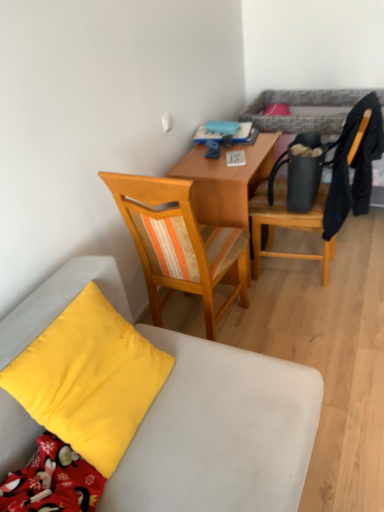
Question: From a real-world perspective, is yellow matte pillow at lower left under matte black chair at upper right, the first chair in the right-to-left sequence?

Choices:
 (A) yes
 (B) no

Answer: (B)

Question: Does yellow matte pillow at lower left have a greater width compared to matte black chair at upper right, which appears as the 3th chair when viewed from the left?

Choices:
 (A) yes
 (B) no

Answer: (B)

Question: Is yellow matte pillow at lower left smaller than matte black chair at upper right, which appears as the 3th chair when viewed from the left?

Choices:
 (A) yes
 (B) no

Answer: (A)

Question: Can you confirm if yellow matte pillow at lower left is positioned to the right of matte black chair at upper right, the first chair in the right-to-left sequence?

Choices:
 (A) yes
 (B) no

Answer: (B)

Question: Is yellow matte pillow at lower left turned away from matte black chair at upper right, which appears as the 3th chair when viewed from the left?

Choices:
 (A) yes
 (B) no

Answer: (B)

Question: Is yellow matte pillow at lower left inside the boundaries of black fabric bed at upper right, or outside?

Choices:
 (A) inside
 (B) outside

Answer: (B)

Question: From the image's perspective, is yellow matte pillow at lower left above or below black fabric bed at upper right?

Choices:
 (A) below
 (B) above

Answer: (A)

Question: Is yellow matte pillow at lower left taller or shorter than black fabric bed at upper right?

Choices:
 (A) tall
 (B) short

Answer: (A)

Question: In the image, is yellow matte pillow at lower left positioned in front of or behind black fabric bed at upper right?

Choices:
 (A) front
 (B) behind

Answer: (A)

Question: From their relative heights in the image, would you say black fabric bed at upper right is taller or shorter than yellow matte pillow at lower left?

Choices:
 (A) short
 (B) tall

Answer: (A)

Question: From the image's perspective, is black fabric bed at upper right above or below yellow matte pillow at lower left?

Choices:
 (A) above
 (B) below

Answer: (A)

Question: Looking at the image, does black fabric bed at upper right seem bigger or smaller compared to yellow matte pillow at lower left?

Choices:
 (A) big
 (B) small

Answer: (A)

Question: In terms of width, does black fabric bed at upper right look wider or thinner when compared to yellow matte pillow at lower left?

Choices:
 (A) thin
 (B) wide

Answer: (B)

Question: Considering their positions, is black fabric bed at upper right located in front of or behind wooden chair at center, arranged as the 1th chair when viewed from the left?

Choices:
 (A) front
 (B) behind

Answer: (B)

Question: Looking at their shapes, would you say black fabric bed at upper right is wider or thinner than wooden chair at center, positioned as the third chair in right-to-left order?

Choices:
 (A) thin
 (B) wide

Answer: (A)